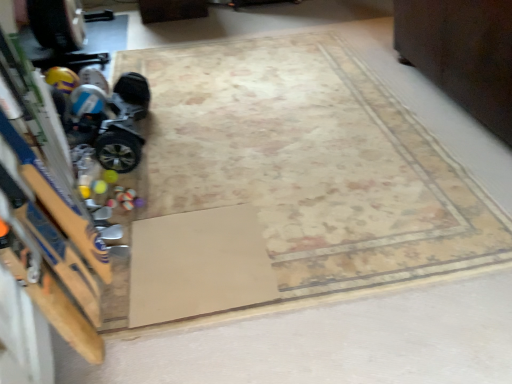
Question: Can you confirm if shiny metallic hoverboard at left is wider than beige carpet at center?

Choices:
 (A) yes
 (B) no

Answer: (B)

Question: Is shiny metallic hoverboard at left facing away from beige carpet at center?

Choices:
 (A) yes
 (B) no

Answer: (B)

Question: From a real-world perspective, does shiny metallic hoverboard at left sit lower than beige carpet at center?

Choices:
 (A) no
 (B) yes

Answer: (A)

Question: Does shiny metallic hoverboard at left come behind beige carpet at center?

Choices:
 (A) yes
 (B) no

Answer: (A)

Question: Does shiny metallic hoverboard at left have a larger size compared to beige carpet at center?

Choices:
 (A) no
 (B) yes

Answer: (A)

Question: From the image's perspective, is shiny metallic hoverboard at left located above beige carpet at center?

Choices:
 (A) no
 (B) yes

Answer: (B)

Question: From the image's perspective, would you say beige carpet at center is shown under shiny metallic hoverboard at left?

Choices:
 (A) no
 (B) yes

Answer: (B)

Question: Does beige carpet at center contain shiny metallic hoverboard at left?

Choices:
 (A) no
 (B) yes

Answer: (A)

Question: Is shiny metallic hoverboard at left at the back of beige carpet at center?

Choices:
 (A) yes
 (B) no

Answer: (B)

Question: Is the position of beige carpet at center less distant than that of shiny metallic hoverboard at left?

Choices:
 (A) yes
 (B) no

Answer: (A)

Question: Is the position of beige carpet at center more distant than that of shiny metallic hoverboard at left?

Choices:
 (A) yes
 (B) no

Answer: (B)

Question: Is beige carpet at center directly adjacent to shiny metallic hoverboard at left?

Choices:
 (A) yes
 (B) no

Answer: (B)

Question: Is shiny metallic hoverboard at left located within dark wood dresser at upper right?

Choices:
 (A) no
 (B) yes

Answer: (A)